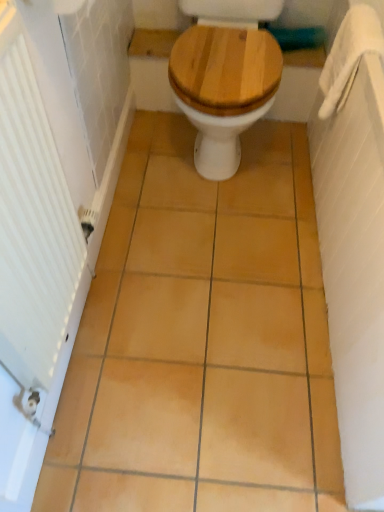
Question: Does white textured radiator at left touch white fabric towel bar at upper right?

Choices:
 (A) yes
 (B) no

Answer: (B)

Question: Can you confirm if white textured radiator at left is shorter than white fabric towel bar at upper right?

Choices:
 (A) no
 (B) yes

Answer: (A)

Question: Is white textured radiator at left positioned with its back to white fabric towel bar at upper right?

Choices:
 (A) yes
 (B) no

Answer: (B)

Question: Considering the relative positions of white textured radiator at left and white fabric towel bar at upper right in the image provided, is white textured radiator at left in front of white fabric towel bar at upper right?

Choices:
 (A) yes
 (B) no

Answer: (A)

Question: Could you tell me if white textured radiator at left is facing white fabric towel bar at upper right?

Choices:
 (A) no
 (B) yes

Answer: (A)

Question: Can you confirm if white textured radiator at left is bigger than white fabric towel bar at upper right?

Choices:
 (A) no
 (B) yes

Answer: (B)

Question: Is wooden at center behind matte yellow tile at center?

Choices:
 (A) no
 (B) yes

Answer: (B)

Question: Can you confirm if wooden at center is taller than matte yellow tile at center?

Choices:
 (A) no
 (B) yes

Answer: (B)

Question: From the image's perspective, is wooden at center under matte yellow tile at center?

Choices:
 (A) no
 (B) yes

Answer: (A)

Question: Is wooden at center thinner than matte yellow tile at center?

Choices:
 (A) yes
 (B) no

Answer: (A)

Question: From a real-world perspective, is wooden at center on matte yellow tile at center?

Choices:
 (A) yes
 (B) no

Answer: (A)

Question: Is wooden at center facing away from matte yellow tile at center?

Choices:
 (A) yes
 (B) no

Answer: (B)

Question: Can you confirm if white fabric towel bar at upper right is wider than matte yellow tile at center?

Choices:
 (A) no
 (B) yes

Answer: (A)